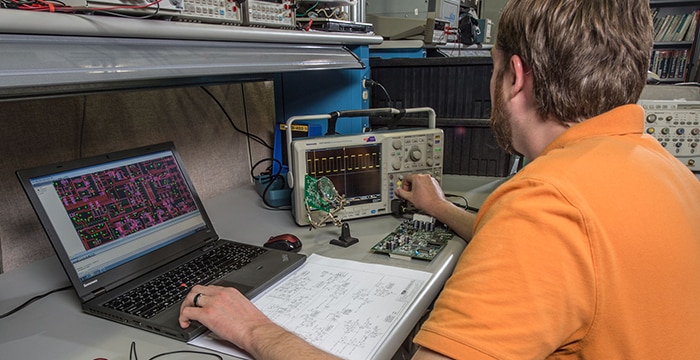
I want to click on computer, so click(x=174, y=250).